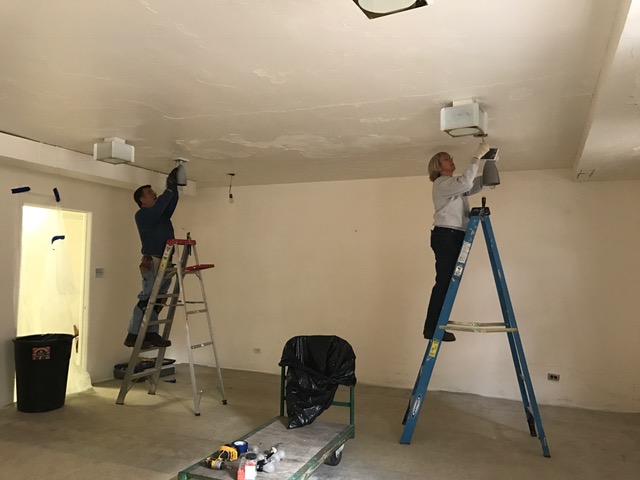
The image size is (640, 480). What are the coordinates of `garbage can` in the screenshot? It's located at (40, 366).